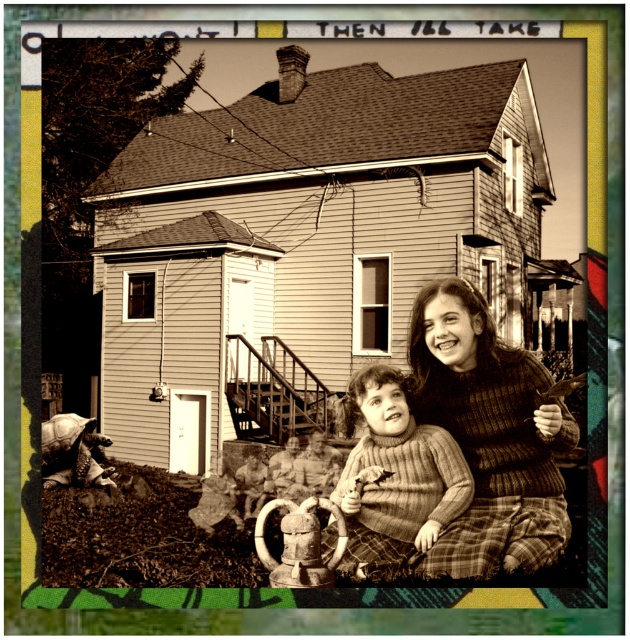
Which is more to the left, knitted sweater at lower right or knitted sweater at center?

knitted sweater at center

Which is more to the right, knitted sweater at lower right or knitted sweater at center?

Positioned to the right is knitted sweater at lower right.

Between point (493, 497) and point (355, 563), which one is positioned in front?

Point (355, 563)

Locate an element on the screen. This screenshot has height=640, width=630. knitted sweater at lower right is located at coordinates [x=490, y=435].